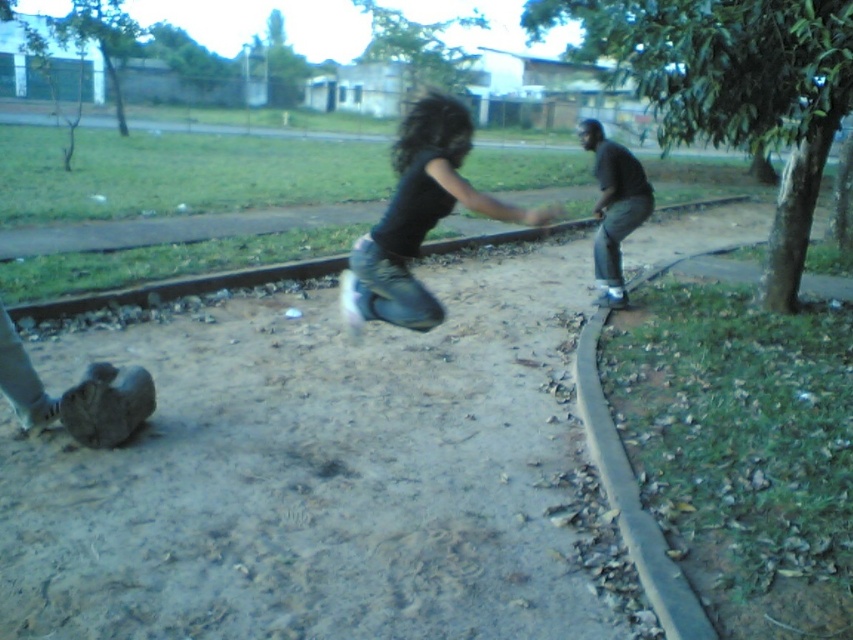
In the scene shown: You are standing at the dirt path in the park and want to place a small flag exactly halfway between point (457, 134) and point (605, 250). Considering their positions relative to the camera, will the flag be closer to the camera than both points?

Point (457, 134) is closer to the camera than point (605, 250). The halfway point between them would be closer to the camera than point (605, 250) but farther than point (457, 134). Therefore, the flag will not be closer to the camera than both points.

You are a fashion designer analyzing clothing items in an image. You notice two items labeled as black matte jeans at center and black matte pants at center. Which of these two items has a larger size?

The black matte pants at center has a larger size than the black matte jeans at center.